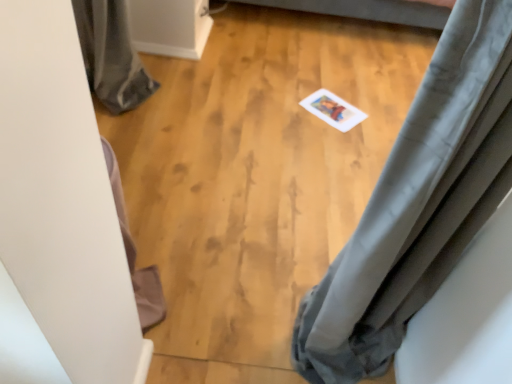
The image size is (512, 384). What are the coordinates of `free space above white paper at center (from a real-world perspective)` in the screenshot? It's located at (334, 107).